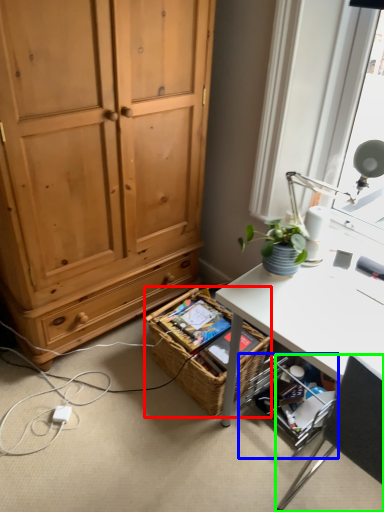
Question: Which is farther away from picnic basket (highlighted by a red box)? shelf (highlighted by a blue box) or chair (highlighted by a green box)?

Choices:
 (A) shelf
 (B) chair

Answer: (B)